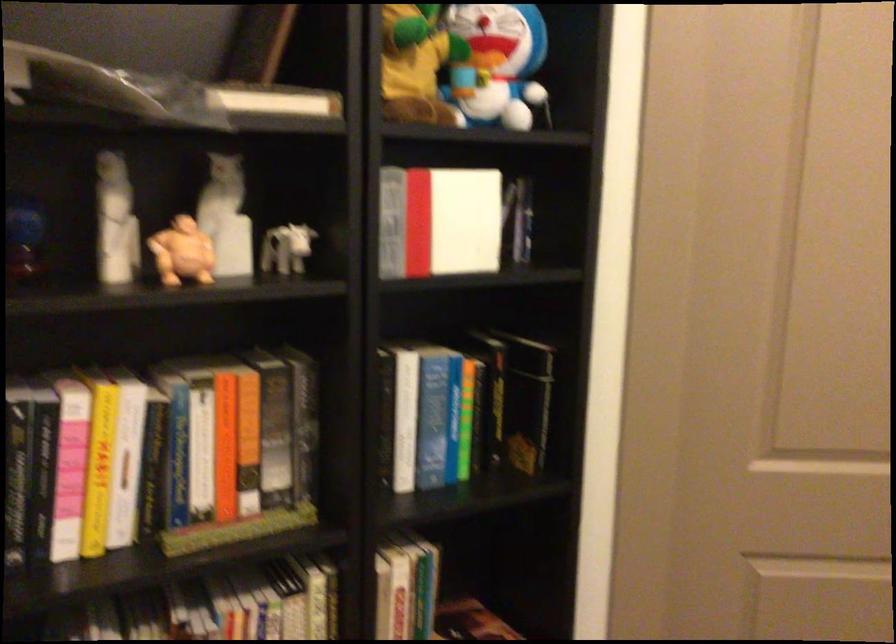
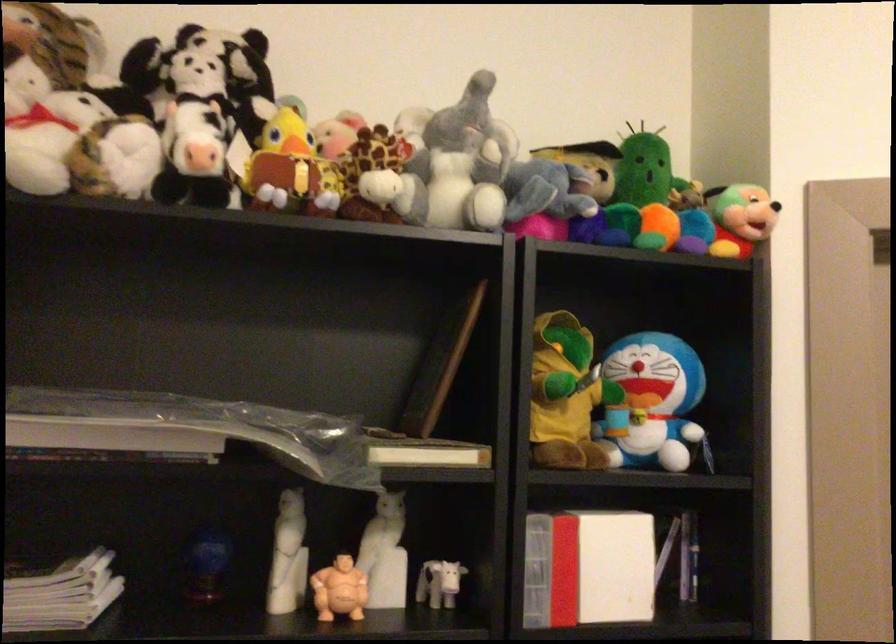
Locate, in the second image, the point that corresponds to [285,251] in the first image.

(438, 583)